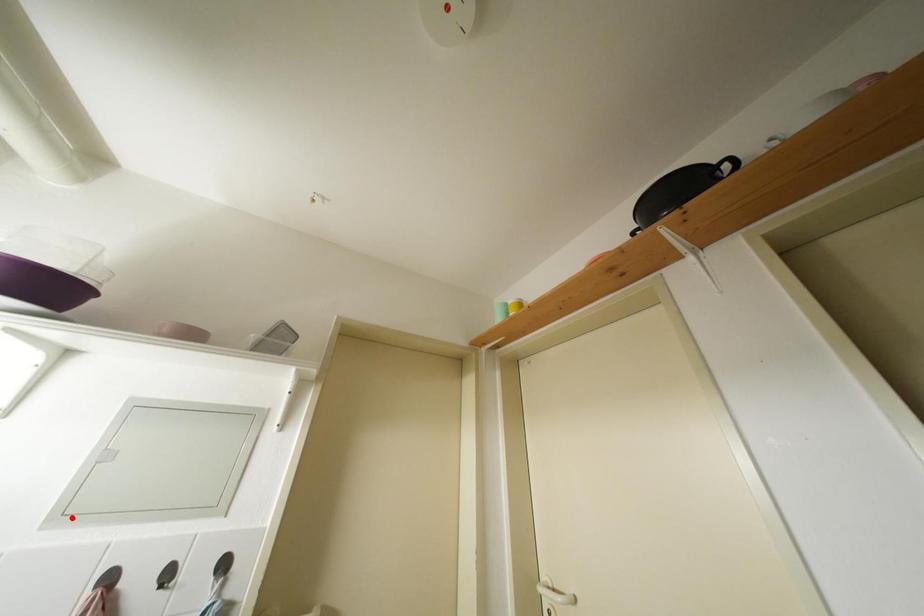
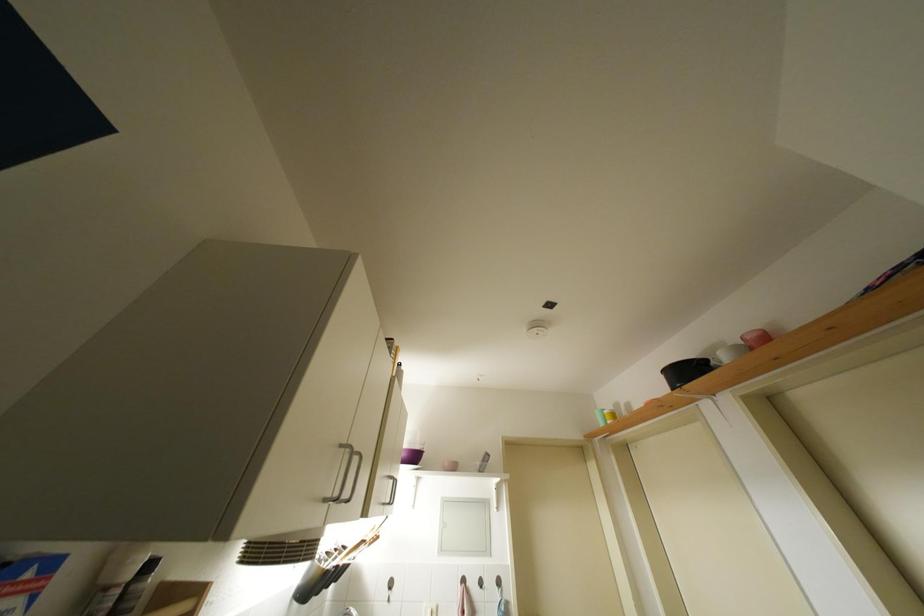
Question: I am providing you with two images of the same scene from different viewpoints. In image1, a red point is highlighted. Considering the same 3D point in image2, which of the following is correct?

Choices:
 (A) It is closer
 (B) It is farther

Answer: (B)